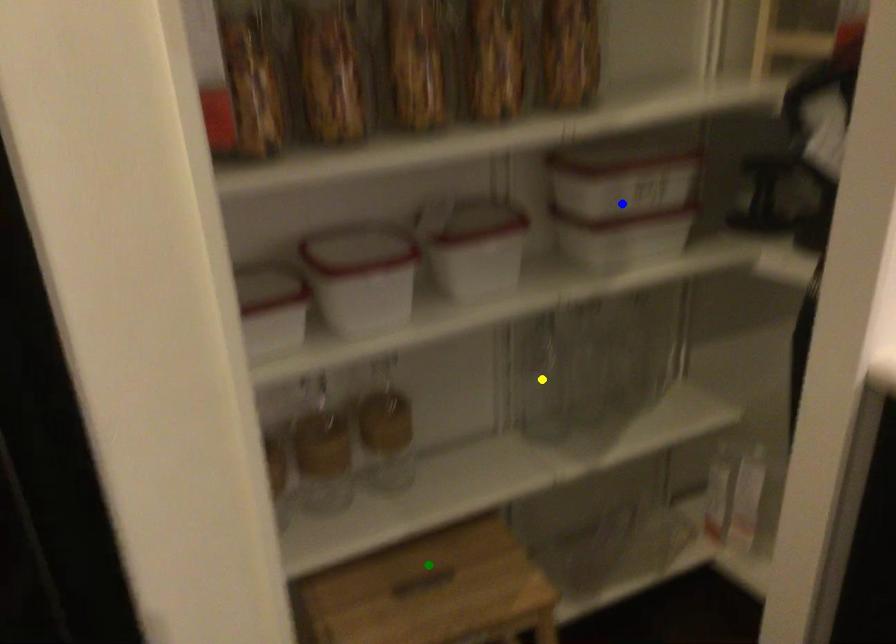
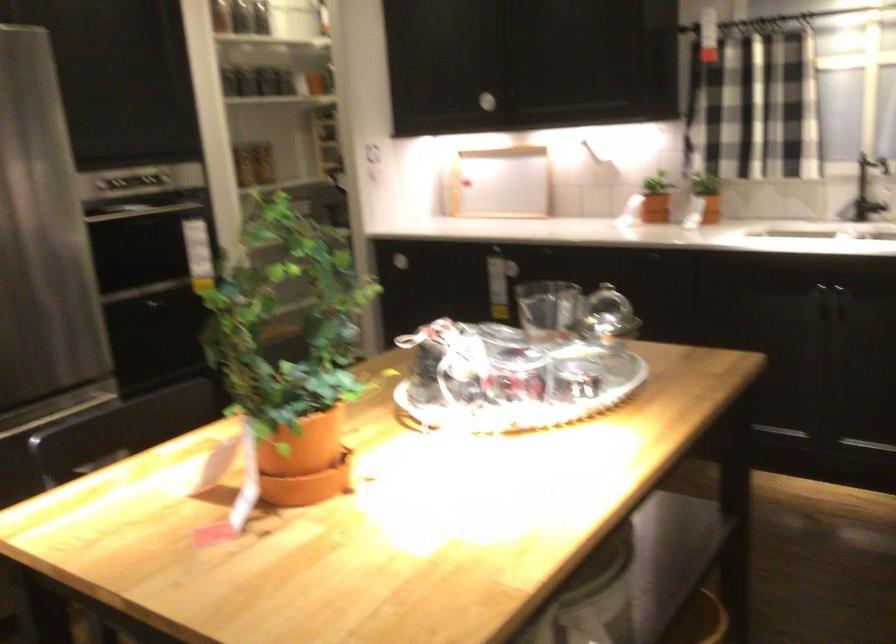
I am providing you with two images of the same scene from different viewpoints. Three points are marked in image1. Which point corresponds to a part or object that is occluded in image2?In image1, three points are marked. Which of them correspond to a part or object that is occluded in image2?Among the three points shown in image1, which one corresponds to a part or object that is no longer visible due to occlusion in image2?

Invisible in image2: blue point, yellow point, green point.